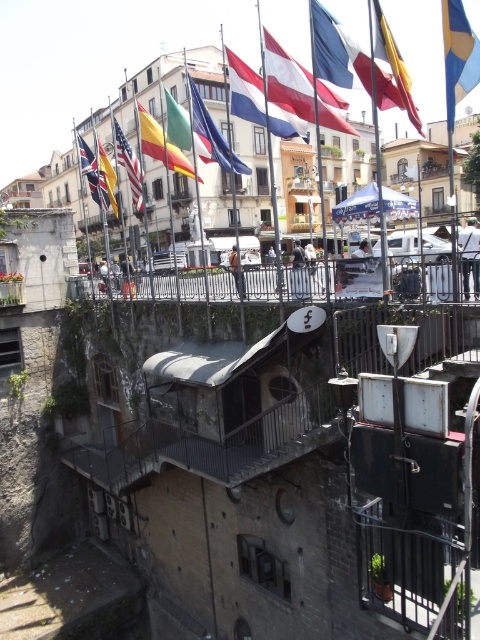
Question: Does green fabric flag at upper center appear on the left side of matte black flag at upper left?

Choices:
 (A) yes
 (B) no

Answer: (B)

Question: Which object is positioned closest to the green fabric flag at upper center?

Choices:
 (A) union jack fabric flag at upper left
 (B) blue fabric flag at upper center

Answer: (A)

Question: Which object is positioned farthest from the union jack fabric flag at upper left?

Choices:
 (A) red-white-blue fabric flag at center
 (B) blue fabric flag at upper right

Answer: (B)

Question: Does blue fabric flag at upper center appear over red and white striped flag at upper center?

Choices:
 (A) yes
 (B) no

Answer: (B)

Question: Which is farther from the black metal railing at center?

Choices:
 (A) matte black flag at upper left
 (B) green fabric flag at upper center

Answer: (A)

Question: Is yellow and blue striped flag at upper right thinner than blue fabric flag at center?

Choices:
 (A) no
 (B) yes

Answer: (A)